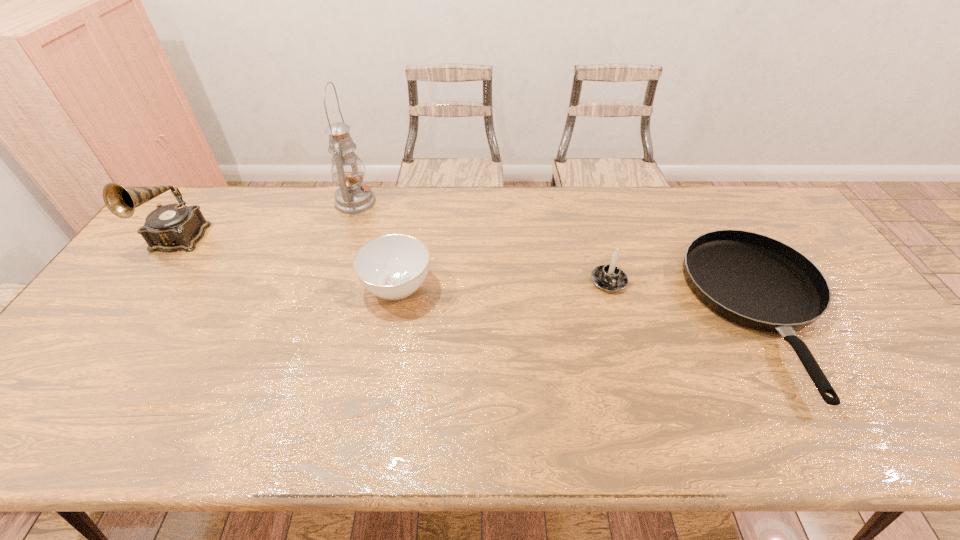
The width and height of the screenshot is (960, 540). What are the coordinates of `empty space between the phonograph record and the chinaware` in the screenshot? It's located at (288, 263).

The height and width of the screenshot is (540, 960). Find the location of `empty location between the third shortest object and the shortest object`. empty location between the third shortest object and the shortest object is located at coordinates (686, 297).

Where is `free space between the third object from right to left and the rightmost object`? Image resolution: width=960 pixels, height=540 pixels. free space between the third object from right to left and the rightmost object is located at coordinates (581, 300).

Select which object appears as the third closest to the second object from right to left. Please provide its 2D coordinates. Your answer should be formatted as a tuple, i.e. [(x, y)], where the tuple contains the x and y coordinates of a point satisfying the conditions above.

[(352, 197)]

Find the location of a particular element. the fourth closest object to the candle holder is located at coordinates (172, 227).

Locate an element on the screen. The image size is (960, 540). free space that satisfies the following two spatial constraints: 1. on the horn of the second shortest object; 2. on the left side of the phonograph record is located at coordinates (142, 287).

This screenshot has height=540, width=960. I want to click on free space that satisfies the following two spatial constraints: 1. on the front side of the oil lamp; 2. on the right side of the third object from left to right, so pos(327,287).